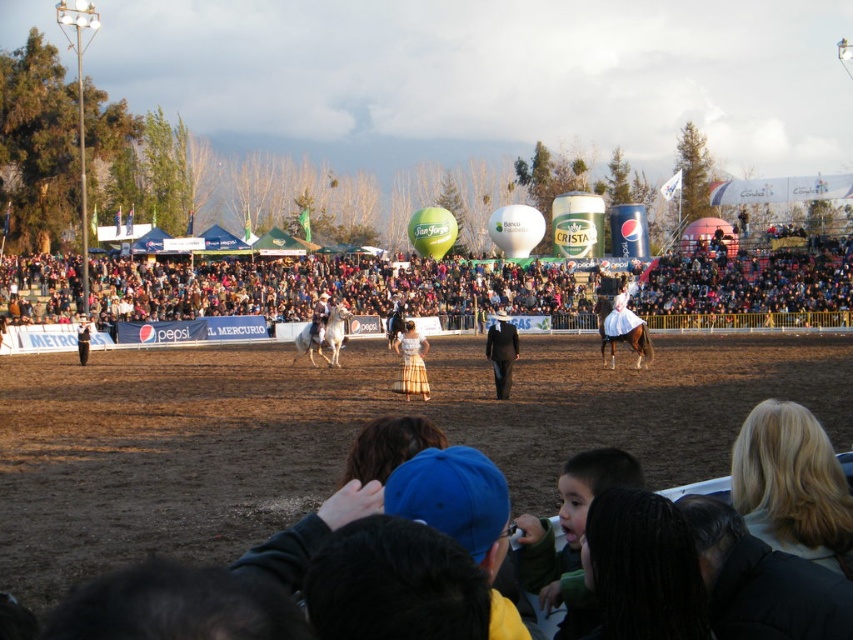
Based on the photo, who is positioned more to the right, blonde hair at upper right or brown glossy horse at center?

brown glossy horse at center

Does blonde hair at upper right have a smaller size compared to brown glossy horse at center?

Correct, blonde hair at upper right occupies less space than brown glossy horse at center.

Is point (786, 481) positioned behind point (637, 356)?

No, (786, 481) is closer to viewer.

Locate an element on the screen. The width and height of the screenshot is (853, 640). blonde hair at upper right is located at coordinates (792, 484).

Between black fabric at lower right and plaid skirt at center, which one appears on the right side from the viewer's perspective?

black fabric at lower right

Which of these two, black fabric at lower right or plaid skirt at center, stands shorter?

With less height is black fabric at lower right.

Image resolution: width=853 pixels, height=640 pixels. Describe the element at coordinates (762, 580) in the screenshot. I see `black fabric at lower right` at that location.

Image resolution: width=853 pixels, height=640 pixels. What are the coordinates of `black fabric at lower right` in the screenshot? It's located at (762, 580).

Describe the element at coordinates (792, 484) in the screenshot. Image resolution: width=853 pixels, height=640 pixels. I see `blonde hair at upper right` at that location.

Where is `blonde hair at upper right`? This screenshot has width=853, height=640. blonde hair at upper right is located at coordinates (792, 484).